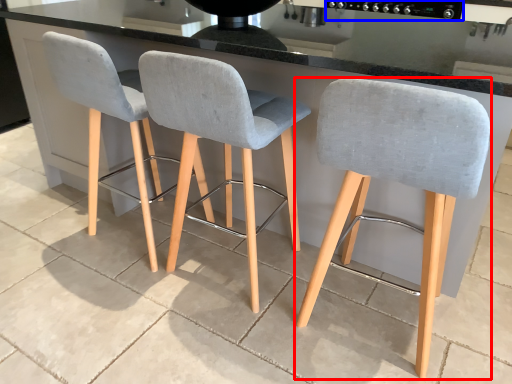
Question: Which object is further to the camera taking this photo, chair (highlighted by a red box) or appliance (highlighted by a blue box)?

Choices:
 (A) chair
 (B) appliance

Answer: (B)